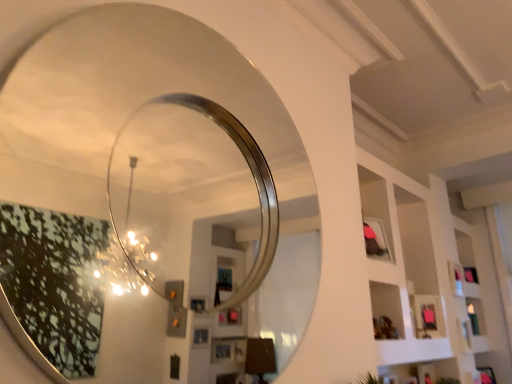
Describe the element at coordinates (125, 103) in the screenshot. This screenshot has height=384, width=512. I see `polished silver mirror at upper left` at that location.

This screenshot has height=384, width=512. I want to click on polished silver mirror at upper left, so click(x=125, y=103).

This screenshot has height=384, width=512. Describe the element at coordinates (410, 268) in the screenshot. I see `white matte shelf at upper right` at that location.

Measure the distance between point [370,189] and camera.

A distance of 2.59 meters exists between point [370,189] and camera.

You are a GUI agent. You are given a task and a screenshot of the screen. Output one action in this format:
    pyautogui.click(x=<x>, y=<y>)
    Task: Click on the white matte shelf at upper right
    
    Given the screenshot: What is the action you would take?
    pyautogui.click(x=410, y=268)

The image size is (512, 384). I want to click on polished silver mirror at upper left, so click(x=125, y=103).

Does polished silver mirror at upper left appear on the right side of white matte shelf at upper right?

No.

Is polished silver mirror at upper left positioned behind white matte shelf at upper right?

No, it is in front of white matte shelf at upper right.

Does point (129, 6) come behind point (410, 343)?

No, it is in front of (410, 343).

From the image's perspective, is polished silver mirror at upper left below white matte shelf at upper right?

Actually, polished silver mirror at upper left appears above white matte shelf at upper right in the image.

From a real-world perspective, is polished silver mirror at upper left positioned above or below white matte shelf at upper right?

polished silver mirror at upper left is situated lower than white matte shelf at upper right in the real world.

Which of these two, polished silver mirror at upper left or white matte shelf at upper right, is thinner?

polished silver mirror at upper left.

Considering the relative sizes of polished silver mirror at upper left and white matte shelf at upper right in the image provided, is polished silver mirror at upper left taller than white matte shelf at upper right?

In fact, polished silver mirror at upper left may be shorter than white matte shelf at upper right.

Considering the relative sizes of polished silver mirror at upper left and white matte shelf at upper right in the image provided, is polished silver mirror at upper left bigger than white matte shelf at upper right?

No.

Is polished silver mirror at upper left positioned beyond the bounds of white matte shelf at upper right?

Yes, polished silver mirror at upper left is outside of white matte shelf at upper right.

Is polished silver mirror at upper left not close to white matte shelf at upper right?

Indeed, polished silver mirror at upper left is not near white matte shelf at upper right.

Is polished silver mirror at upper left facing towards white matte shelf at upper right?

No, polished silver mirror at upper left does not turn towards white matte shelf at upper right.

Can you tell me how much polished silver mirror at upper left and white matte shelf at upper right differ in facing direction?

polished silver mirror at upper left and white matte shelf at upper right are facing 0.582 degrees away from each other.

Find the location of a particular element. Image resolution: width=512 pixels, height=384 pixels. shelf below the polished silver mirror at upper left (from the image's perspective) is located at coordinates (410, 268).

Does white matte shelf at upper right appear on the left side of polished silver mirror at upper left?

In fact, white matte shelf at upper right is to the right of polished silver mirror at upper left.

Considering their positions, is white matte shelf at upper right located in front of or behind polished silver mirror at upper left?

In the image, white matte shelf at upper right appears behind polished silver mirror at upper left.

Which is behind, point (374, 264) or point (34, 132)?

The point (34, 132) is farther from the camera.

From the image's perspective, does white matte shelf at upper right appear higher than polished silver mirror at upper left?

Incorrect, from the image's perspective, white matte shelf at upper right is lower than polished silver mirror at upper left.

From a real-world perspective, which object rests below the other?

polished silver mirror at upper left is physically lower.

Which of these two, white matte shelf at upper right or polished silver mirror at upper left, is thinner?

With smaller width is polished silver mirror at upper left.

From their relative heights in the image, would you say white matte shelf at upper right is taller or shorter than polished silver mirror at upper left?

Considering their sizes, white matte shelf at upper right has more height than polished silver mirror at upper left.

Is white matte shelf at upper right bigger or smaller than polished silver mirror at upper left?

Considering their sizes, white matte shelf at upper right takes up more space than polished silver mirror at upper left.

Is white matte shelf at upper right not inside polished silver mirror at upper left?

white matte shelf at upper right is positioned outside polished silver mirror at upper left.

Is white matte shelf at upper right next to polished silver mirror at upper left and touching it?

No.

Is white matte shelf at upper right facing towards polished silver mirror at upper left?

No, white matte shelf at upper right is not turned towards polished silver mirror at upper left.

You are a GUI agent. You are given a task and a screenshot of the screen. Output one action in this format:
    pyautogui.click(x=<x>, y=<y>)
    Task: Click on the shelf above the polished silver mirror at upper left (from a real-world perspective)
    
    Given the screenshot: What is the action you would take?
    pyautogui.click(x=410, y=268)

Locate an element on the screen. shelf below the polished silver mirror at upper left (from the image's perspective) is located at coordinates (410, 268).

This screenshot has width=512, height=384. Identify the location of shelf that is above the polished silver mirror at upper left (from a real-world perspective). (410, 268).